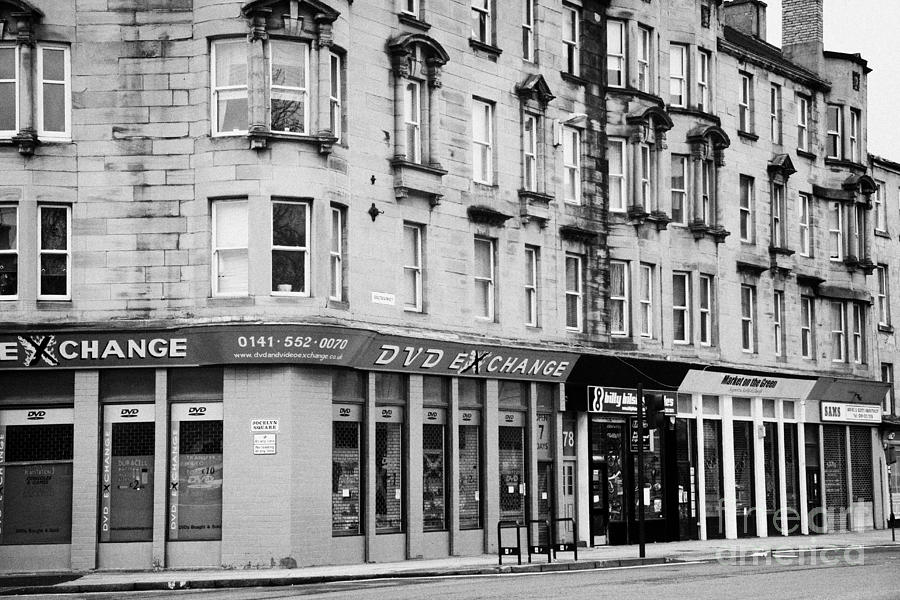
Where is `windows`? Image resolution: width=900 pixels, height=600 pixels. windows is located at coordinates (281, 68), (227, 56), (230, 110).